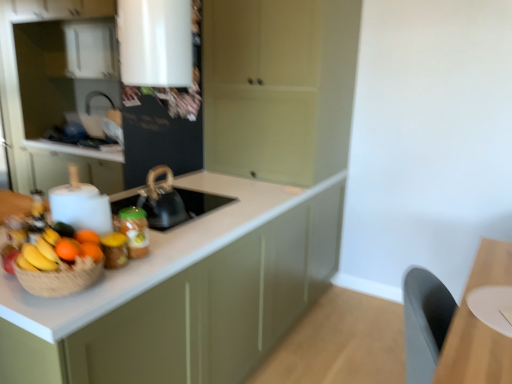
Question: From a real-world perspective, is matte green cabinet at center, acting as the 1th cabinetry starting from the right, physically above orange matte at left, the 1th orange from the front?

Choices:
 (A) no
 (B) yes

Answer: (B)

Question: Could you tell me if matte green cabinet at center, acting as the 1th cabinetry starting from the right, is turned towards orange matte at left, acting as the third orange starting from the back?

Choices:
 (A) yes
 (B) no

Answer: (A)

Question: Is matte green cabinet at center, the third cabinetry positioned from the left, positioned with its back to orange matte at left, the 1th orange from the front?

Choices:
 (A) yes
 (B) no

Answer: (B)

Question: Is matte green cabinet at center, acting as the 1th cabinetry starting from the right, not within orange matte at left, the 1th orange from the front?

Choices:
 (A) no
 (B) yes

Answer: (B)

Question: Is matte green cabinet at center, the third cabinetry positioned from the left, thinner than orange matte at left, acting as the third orange starting from the back?

Choices:
 (A) no
 (B) yes

Answer: (A)

Question: From the image's perspective, is orange matte at left, the 1th orange from the front, below matte green cabinet at center, acting as the 1th cabinetry starting from the right?

Choices:
 (A) no
 (B) yes

Answer: (B)

Question: Is the position of orange matte at left, the 1th orange from the front, more distant than that of matte green cabinet at center, acting as the 1th cabinetry starting from the right?

Choices:
 (A) no
 (B) yes

Answer: (A)

Question: Can you confirm if orange matte at left, acting as the third orange starting from the back, is positioned to the right of matte green cabinet at center, acting as the 1th cabinetry starting from the right?

Choices:
 (A) yes
 (B) no

Answer: (B)

Question: Can you confirm if orange matte at left, acting as the third orange starting from the back, is positioned to the left of matte green cabinet at center, acting as the 1th cabinetry starting from the right?

Choices:
 (A) yes
 (B) no

Answer: (A)

Question: Could matte green cabinet at center, the third cabinetry positioned from the left, be considered to be inside orange matte at left, the 1th orange from the front?

Choices:
 (A) yes
 (B) no

Answer: (B)

Question: Could you tell me if orange matte at left, acting as the third orange starting from the back, is facing matte green cabinet at center, acting as the 1th cabinetry starting from the right?

Choices:
 (A) no
 (B) yes

Answer: (A)

Question: Is orange matte at left, arranged as the second orange when viewed from the back, behind matte green cabinet at center, acting as the 1th cabinetry starting from the right?

Choices:
 (A) yes
 (B) no

Answer: (B)